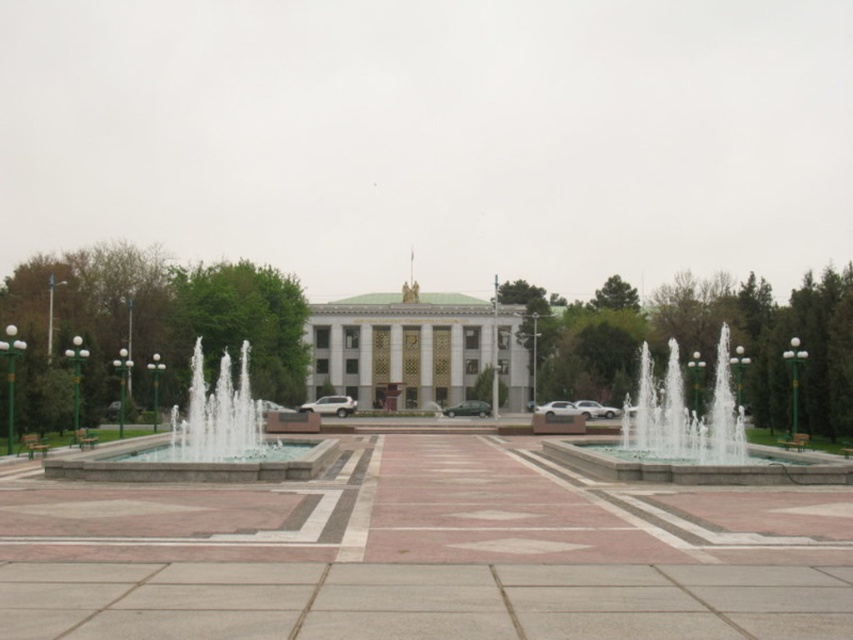
You are standing in the plaza and want to take a photo of the green marble palace at center. Where should you position yourself to capture the palace in the frame?

The green marble palace at center is located at point (416,349), so you should position yourself directly in front of the palace to capture it in the frame.

You are standing in the plaza and notice the clear stone fountain at center and the clear glass water at center. Which one has a greater height?

The clear glass water at center has a greater height compared to the clear stone fountain at center.